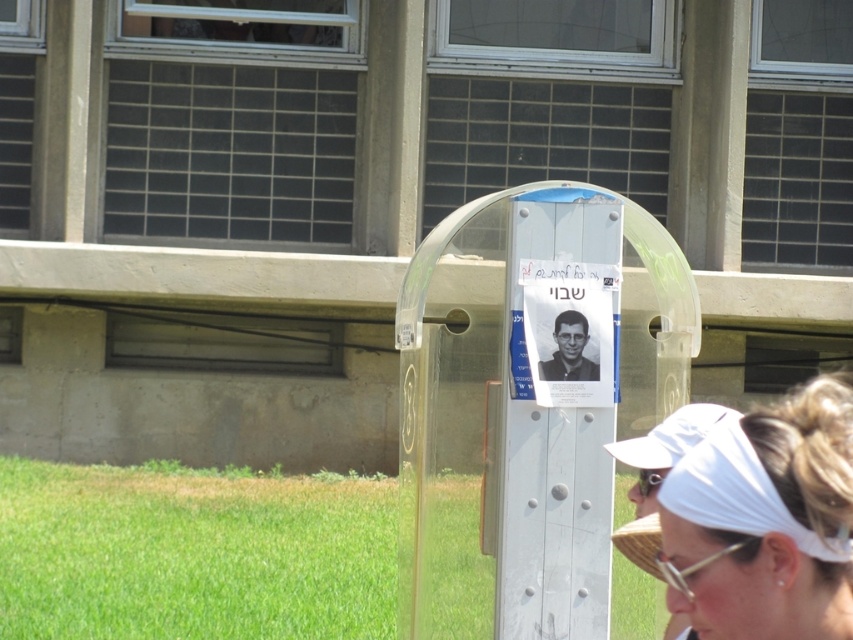
Question: Does white fabric headband at lower right appear on the right side of black matte photo frame at center?

Choices:
 (A) no
 (B) yes

Answer: (B)

Question: From the image, what is the correct spatial relationship of white fabric headband at lower right in relation to black matte photo frame at center?

Choices:
 (A) below
 (B) above

Answer: (A)

Question: Which point is closer to the camera?

Choices:
 (A) (579, 337)
 (B) (685, 596)
 (C) (834, 472)
 (D) (392, 572)

Answer: (C)

Question: In this image, where is green grass at lower left located relative to white fabric headband at lower right?

Choices:
 (A) left
 (B) right

Answer: (A)

Question: Which point appears farthest from the camera in this image?

Choices:
 (A) (141, 560)
 (B) (579, 356)

Answer: (A)

Question: Estimate the real-world distances between objects in this image. Which object is closer to the green grass at lower left?

Choices:
 (A) white fabric headband at lower right
 (B) black matte photo frame at center
 (C) clear plastic goggles at center

Answer: (B)